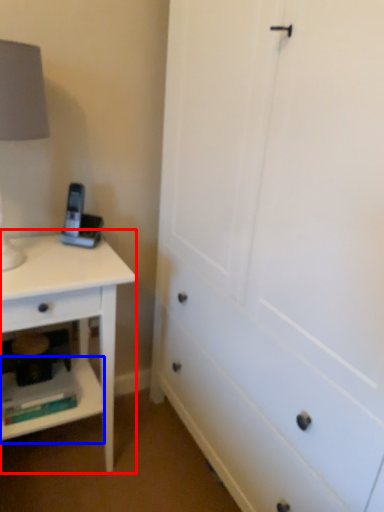
Question: Which object is closer to the camera taking this photo, nightstand (highlighted by a red box) or shelf (highlighted by a blue box)?

Choices:
 (A) nightstand
 (B) shelf

Answer: (A)